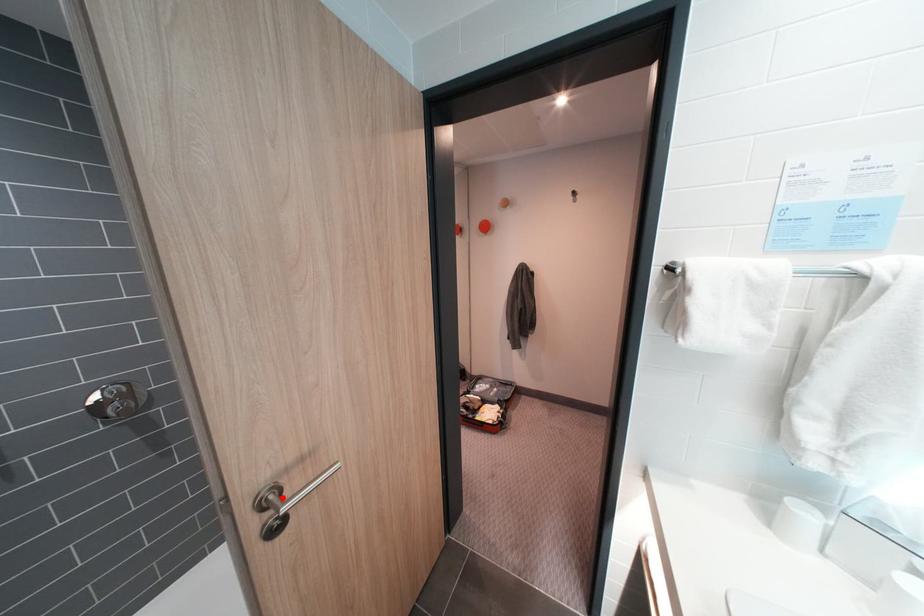
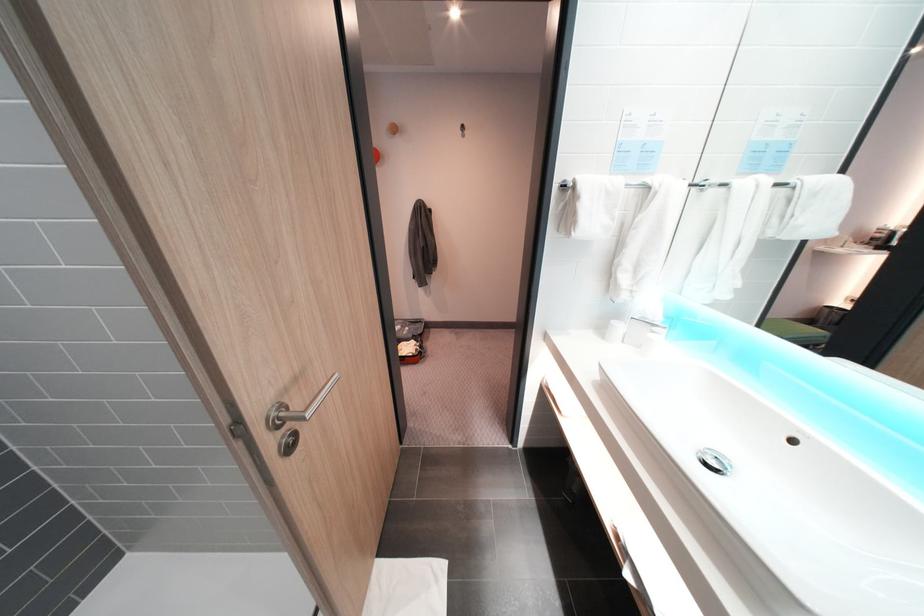
Find the pixel in the second image that matches the highlighted location in the first image.

(294, 415)